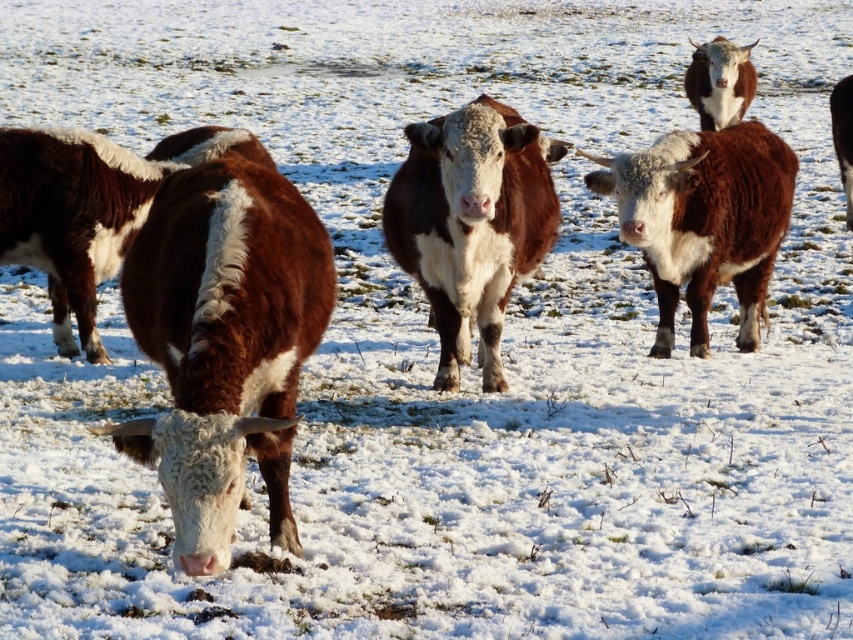
Question: Can you confirm if brown furry cow at center is positioned to the left of white glossy bull at upper right?

Choices:
 (A) yes
 (B) no

Answer: (A)

Question: Is brown fuzzy cow at left closer to the viewer compared to white glossy bull at upper right?

Choices:
 (A) yes
 (B) no

Answer: (A)

Question: Estimate the real-world distances between objects in this image. Which object is closer to the brown/white textured cow at center?

Choices:
 (A) brown furry cow at center
 (B) white glossy bull at upper right

Answer: (A)

Question: Can you confirm if brown/white fur at center is smaller than brown furry cow at center?

Choices:
 (A) no
 (B) yes

Answer: (B)

Question: Which of these objects is positioned farthest from the brown/white textured cow at center?

Choices:
 (A) brown glossy bull at upper right
 (B) brown/white fur at center
 (C) brown furry cow at center

Answer: (A)

Question: Which of these objects is positioned farthest from the brown fuzzy cow at left?

Choices:
 (A) brown/white fur at center
 (B) brown glossy bull at upper right

Answer: (B)